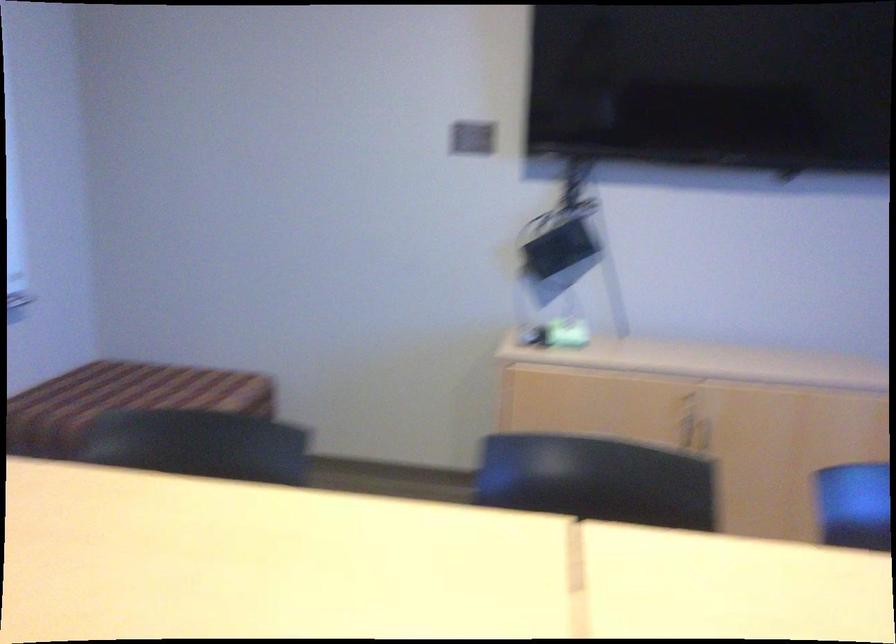
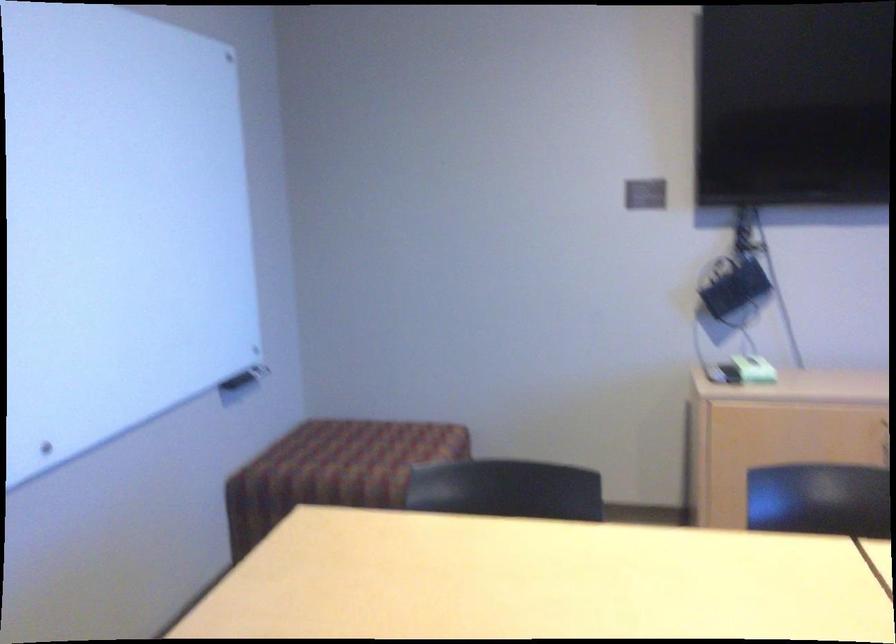
Where in the second image is the point corresponding to (558,245) from the first image?

(734, 289)